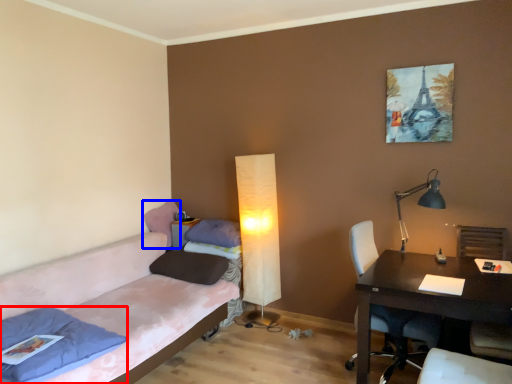
Question: Among these objects, which one is farthest to the camera, pillow (highlighted by a red box) or pillow (highlighted by a blue box)?

Choices:
 (A) pillow
 (B) pillow

Answer: (B)